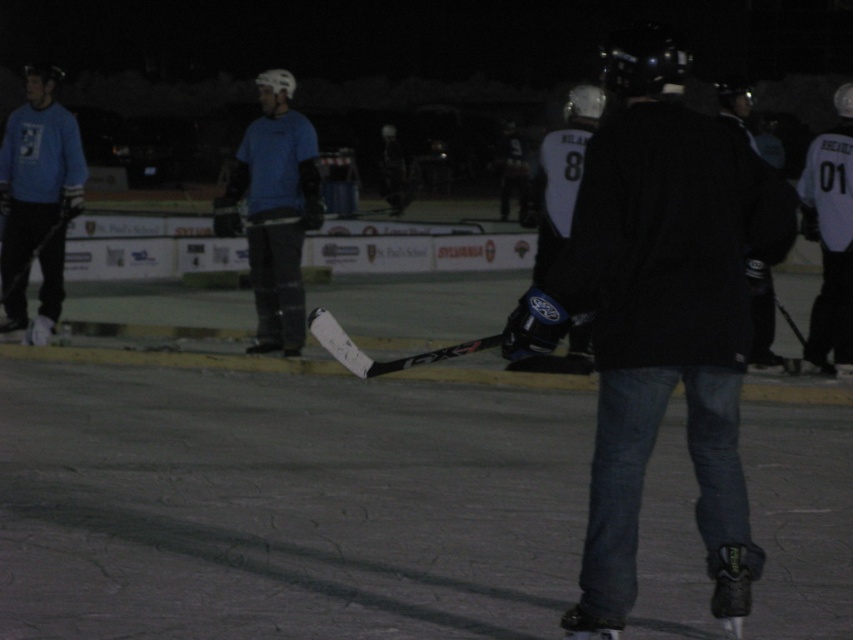
Question: Does blue matte hockey stick at center appear over white jersey at center?

Choices:
 (A) yes
 (B) no

Answer: (B)

Question: Which object is the closest to the white jersey at center?

Choices:
 (A) matte blue sweater at left
 (B) black matte jacket at center

Answer: (B)

Question: Which object is the farthest from the matte blue sweater at left?

Choices:
 (A) black matte jacket at center
 (B) blue matte hockey stick at center

Answer: (A)

Question: Does black matte jacket at center come behind blue matte hockey stick at center?

Choices:
 (A) yes
 (B) no

Answer: (B)

Question: Is matte blue sweater at left thinner than white jersey at center?

Choices:
 (A) no
 (B) yes

Answer: (A)

Question: Estimate the real-world distances between objects in this image. Which object is farther from the black matte jacket at center?

Choices:
 (A) matte blue sweater at left
 (B) blue matte hockey stick at center
 (C) white jersey at center

Answer: (A)